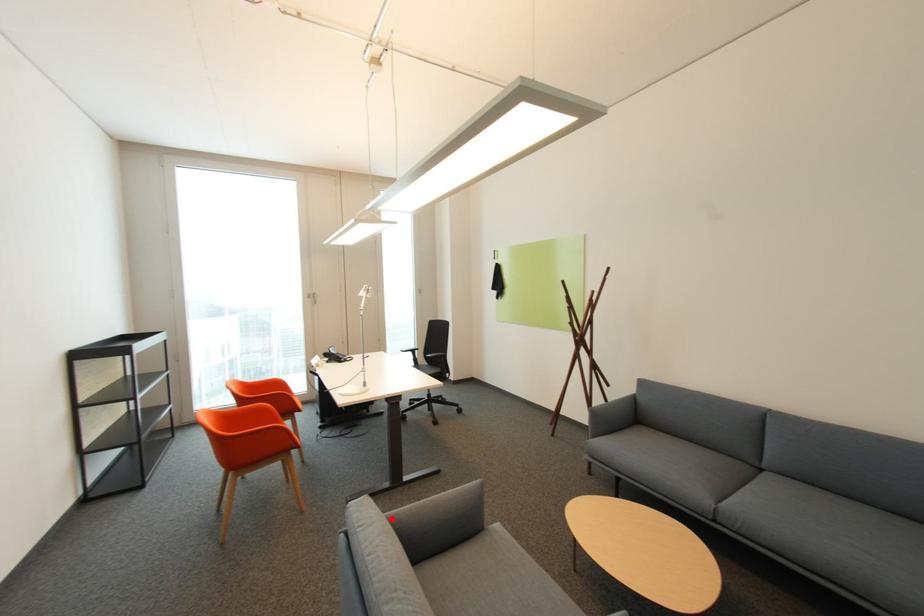
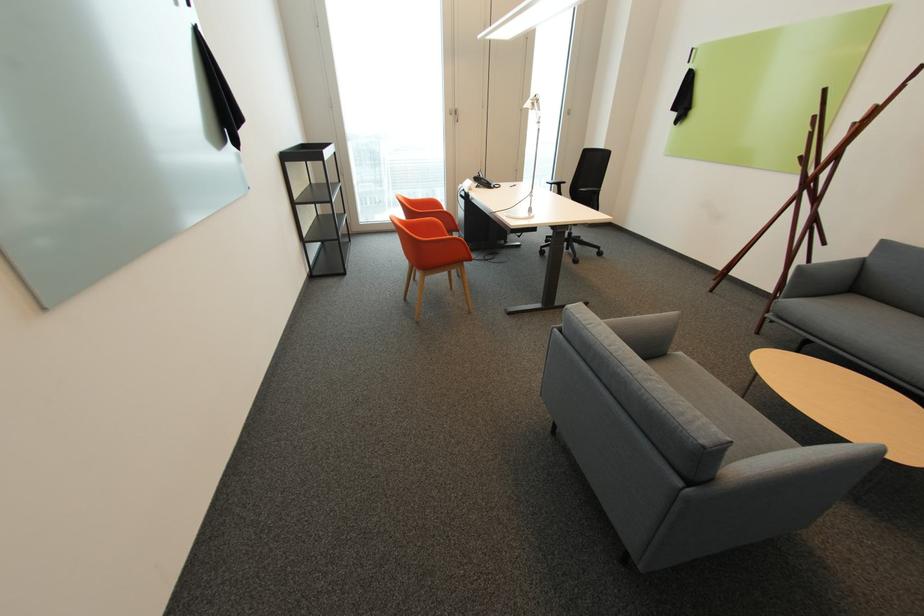
Where in the second image is the point corresponding to the highlighted location from the first image?

(610, 323)